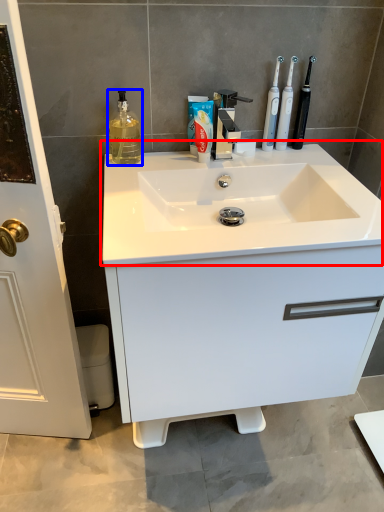
Question: Among these objects, which one is nearest to the camera, sink (highlighted by a red box) or cleaning product (highlighted by a blue box)?

Choices:
 (A) sink
 (B) cleaning product

Answer: (A)